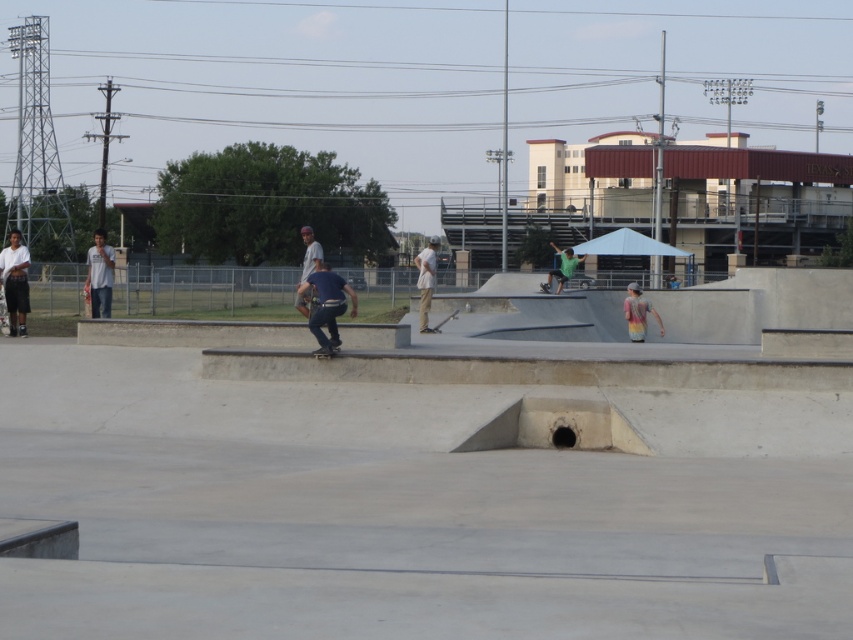
Question: Is smooth concrete skate park at center closer to the viewer compared to rainbow tie-dye shirt at center?

Choices:
 (A) no
 (B) yes

Answer: (B)

Question: Does light gray t-shirt at left have a greater width compared to green matte shirt at center?

Choices:
 (A) no
 (B) yes

Answer: (B)

Question: Which object is farther from the camera taking this photo?

Choices:
 (A) white cotton shirt at left
 (B) rainbow tie-dye shirt at center
 (C) dark blue jeans at center

Answer: (B)

Question: Which point appears farthest from the camera in this image?

Choices:
 (A) (16, 296)
 (B) (640, 557)
 (C) (323, 266)

Answer: (A)

Question: Which object appears farthest from the camera in this image?

Choices:
 (A) rainbow tie-dye shirt at center
 (B) dark blue jeans at center
 (C) light brown canvas pants at center

Answer: (A)

Question: From the image, what is the correct spatial relationship of light brown canvas pants at center in relation to gray matte shirt at center?

Choices:
 (A) left
 (B) right

Answer: (B)